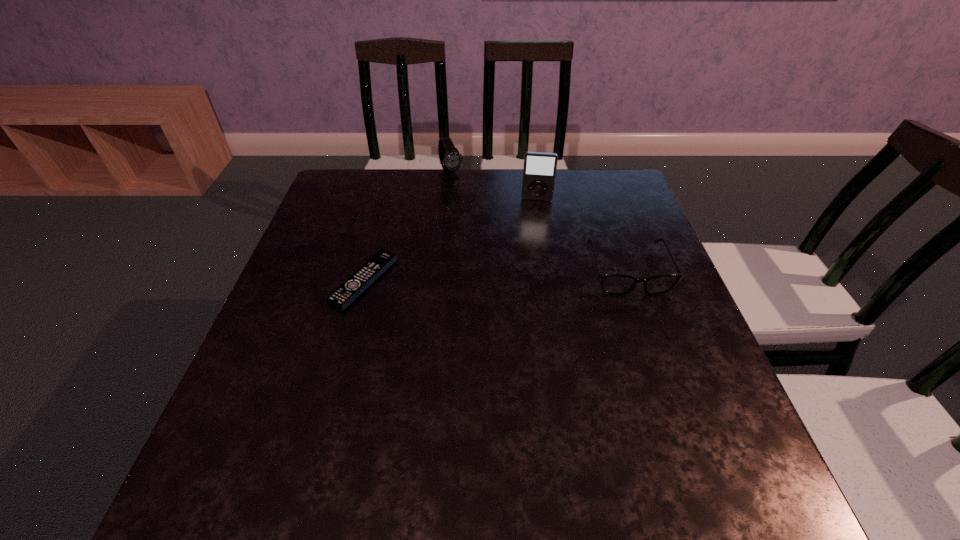
Locate an element on the screen. The image size is (960, 540). remote control is located at coordinates (347, 292).

Where is `the leftmost object`? This screenshot has width=960, height=540. the leftmost object is located at coordinates (347, 292).

Identify the location of the rightmost object. (618, 284).

At what (x,y) coordinates should I click in order to perform the action: click on the third tallest object. Please return your answer as a coordinate pair (x, y). Image resolution: width=960 pixels, height=540 pixels. Looking at the image, I should click on tap(618, 284).

The width and height of the screenshot is (960, 540). Identify the location of the second farthest object. (539, 172).

Where is `iPod`? iPod is located at coordinates (539, 172).

Locate an element on the screen. Image resolution: width=960 pixels, height=540 pixels. the second tallest object is located at coordinates (450, 159).

The image size is (960, 540). I want to click on watch, so click(450, 159).

I want to click on vacant point located 0.390m on the back of the shortest object, so click(394, 172).

Where is `free space located on the front-facing side of the rightmost object`? This screenshot has height=540, width=960. free space located on the front-facing side of the rightmost object is located at coordinates (656, 351).